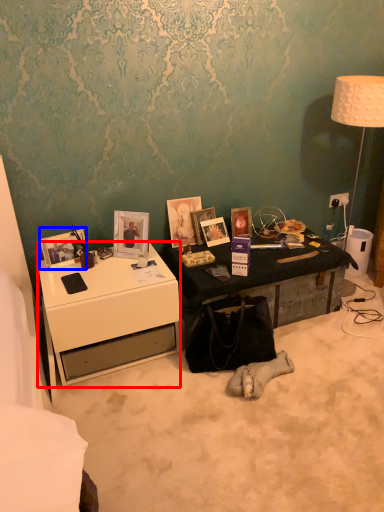
Question: Which object appears closest to the camera in this image, desk (highlighted by a red box) or picture frame (highlighted by a blue box)?

Choices:
 (A) desk
 (B) picture frame

Answer: (A)